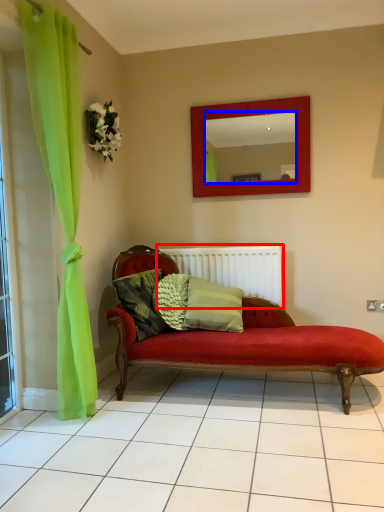
Question: Among these objects, which one is nearest to the camera, radiator (highlighted by a red box) or mirror (highlighted by a blue box)?

Choices:
 (A) radiator
 (B) mirror

Answer: (B)